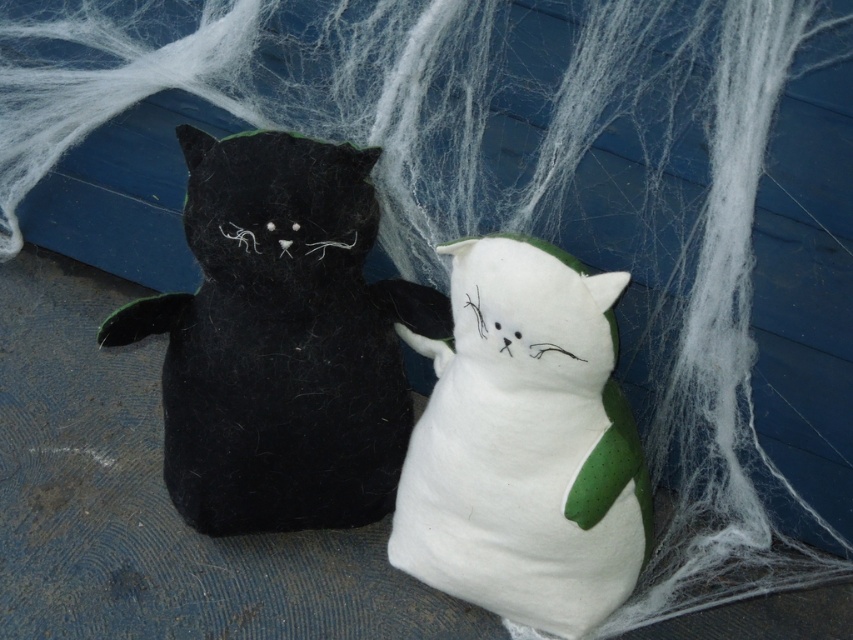
You are a photographer setting up a shot of the two cat figures. You want to ensure that the cat at point [294,419] stays in focus while the other cat at point [469,595] is slightly blurred. Based on their positions, which cat should you focus on to achieve this effect?

You should focus on the cat at point [294,419] because it is in front of the cat at point [469,595]. By focusing on the closer subject, the background cat will naturally appear blurred.

You are a child who wants to place both the matte black plush cat at left and the white felt cat at center on your shelf. The shelf has a maximum width capacity of 30 cm. If the combined width of both cats is 35 cm, will they fit together on the shelf?

The combined width of the matte black plush cat at left and the white felt cat at center is 35 cm, which exceeds the shelf capacity of 30 cm. Therefore, they cannot fit together on the shelf.

From the picture: You are placing a new decorative item at coordinate point 0.533, 0.331 in the scene. Which object from the following list would you expect to find there? Choose from the objects listed below. 1. matte black plush cat at left 2. a green pillow 3. a spiderweb fabric

The matte black plush cat at left is positioned at point (281, 340), so you would find the matte black plush cat at left there.